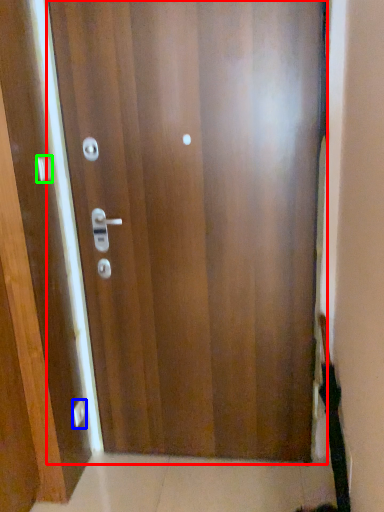
Question: Which object is the closest to the door (highlighted by a red box)? Choose among these: knob (highlighted by a blue box) or handle (highlighted by a green box).

Choices:
 (A) knob
 (B) handle

Answer: (B)